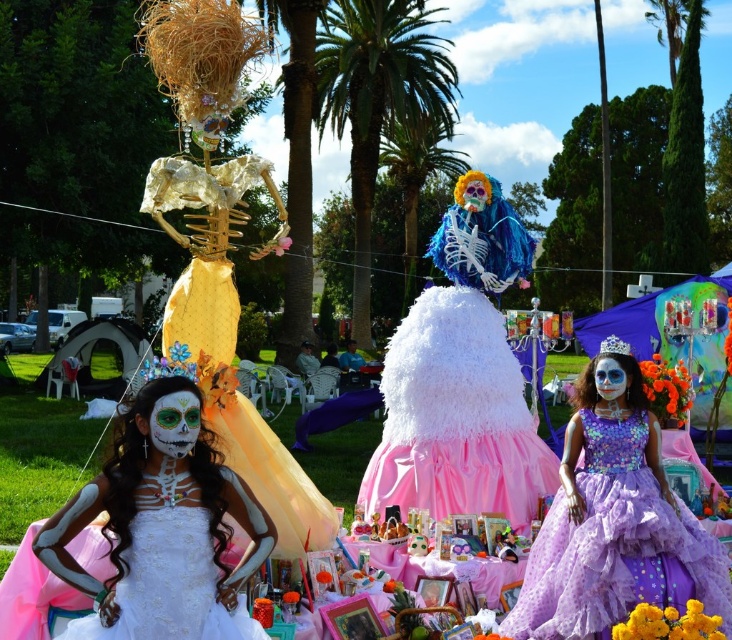
You are a photographer at the event and want to capture both the white matte dress at center and the lavender tulle dress at right in a single shot. Based on their positions, which dress should you focus on first to ensure both are in frame?

The white matte dress at center is positioned on the left side of lavender tulle dress at right, so you should focus on the lavender tulle dress at right first to ensure both are in frame.

Based on the photo, you are a photographer trying to capture a group photo of the white matte dress at center and the lavender tulle dress at right. If your camera has a maximum focus range of 8 feet, will you be able to include both subjects in the same frame without moving either of them?

The distance between the white matte dress at center and the lavender tulle dress at right is 8.48 feet. Since the camera can only focus up to 8 feet, the subjects are slightly out of range. You will need to move them closer or use a different camera with a longer focus range.